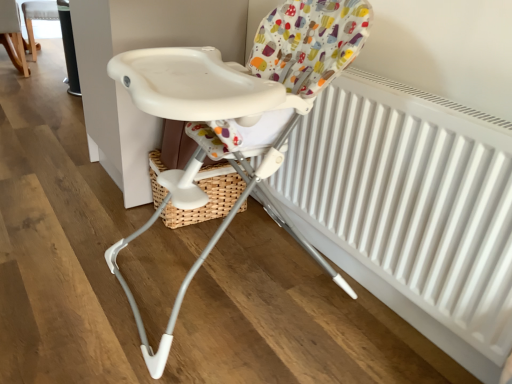
Where is `white matte radiator at center`? white matte radiator at center is located at coordinates (411, 203).

Image resolution: width=512 pixels, height=384 pixels. Find the location of `white plastic highchair at center, the first chair positioned from the right`. white plastic highchair at center, the first chair positioned from the right is located at coordinates (239, 115).

In the scene shown: From the image's perspective, is white plastic highchair at upper center, placed as the second chair when sorted from left to right, positioned above or below white plastic chair at upper left, the 2th chair ordered from the bottom?

From the image's perspective, white plastic highchair at upper center, placed as the second chair when sorted from left to right, appears above white plastic chair at upper left, the 2th chair ordered from the bottom.

Which is in front, white plastic highchair at upper center, placed as the 2th chair when sorted from right to left, or white plastic chair at upper left, the first chair viewed from the left?

white plastic chair at upper left, the first chair viewed from the left, is in front.

Which is in front, point (35, 55) or point (21, 41)?

Positioned in front is point (21, 41).

Where is `the 2nd chair located beneath the white plastic highchair at center, marked as the third chair in a top-to-bottom arrangement (from a real-world perspective)`? the 2nd chair located beneath the white plastic highchair at center, marked as the third chair in a top-to-bottom arrangement (from a real-world perspective) is located at coordinates (37, 19).

Is point (22, 3) closer or farther from the camera than point (213, 131)?

Point (22, 3).

From the picture: In the image, is white plastic highchair at upper center, which ranks as the third chair in front-to-back order, positioned in front of or behind white plastic highchair at center, the first chair positioned from the right?

white plastic highchair at upper center, which ranks as the third chair in front-to-back order, is behind white plastic highchair at center, the first chair positioned from the right.

Would you say white plastic highchair at center, acting as the first chair starting from the bottom, is to the left or to the right of white matte radiator at center in the picture?

Clearly, white plastic highchair at center, acting as the first chair starting from the bottom, is on the left of white matte radiator at center in the image.

Which of these two, white plastic highchair at center, the first chair positioned from the right, or white matte radiator at center, stands shorter?

white matte radiator at center.

Is point (282, 214) positioned after point (431, 282)?

Yes, it is behind point (431, 282).

Consider the image. Which is behind, white plastic highchair at center, acting as the first chair starting from the bottom, or white matte radiator at center?

white matte radiator at center is behind.

Considering the positions of points (22, 40) and (30, 26), is point (22, 40) farther from camera compared to point (30, 26)?

No, (22, 40) is in front of (30, 26).

Can you confirm if white plastic chair at upper left, placed as the second chair when sorted from front to back, is shorter than white plastic highchair at upper center, placed as the second chair when sorted from left to right?

Incorrect, the height of white plastic chair at upper left, placed as the second chair when sorted from front to back, does not fall short of that of white plastic highchair at upper center, placed as the second chair when sorted from left to right.

From a real-world perspective, does white plastic chair at upper left, the third chair viewed from the right, stand above white plastic highchair at upper center, which is the 1th chair in top-to-bottom order?

Yes, from a real-world perspective, white plastic chair at upper left, the third chair viewed from the right, is above white plastic highchair at upper center, which is the 1th chair in top-to-bottom order.

Which is more to the right, white plastic chair at upper left, placed as the second chair when sorted from front to back, or white plastic highchair at upper center, placed as the 2th chair when sorted from right to left?

From the viewer's perspective, white plastic highchair at upper center, placed as the 2th chair when sorted from right to left, appears more on the right side.

Considering the sizes of objects white plastic highchair at center, which ranks as the 1th chair in front-to-back order, and white plastic chair at upper left, the 2th chair ordered from the bottom, in the image provided, who is thinner, white plastic highchair at center, which ranks as the 1th chair in front-to-back order, or white plastic chair at upper left, the 2th chair ordered from the bottom,?

white plastic chair at upper left, the 2th chair ordered from the bottom.

How distant is white plastic highchair at center, the first chair positioned from the right, from white plastic chair at upper left, the 2th chair ordered from the bottom?

white plastic highchair at center, the first chair positioned from the right, is 2.80 meters away from white plastic chair at upper left, the 2th chair ordered from the bottom.

Locate an element on the screen. chair above the white plastic chair at upper left, the first chair viewed from the left (from a real-world perspective) is located at coordinates (239, 115).

Could you tell me if white plastic highchair at center, marked as the third chair in a top-to-bottom arrangement, is turned towards white plastic chair at upper left, positioned as the 2th chair in back-to-front order?

No.

From a real-world perspective, is white plastic highchair at center, marked as the third chair in a top-to-bottom arrangement, above or below white plastic highchair at upper center, which is the 1th chair in top-to-bottom order?

white plastic highchair at center, marked as the third chair in a top-to-bottom arrangement, is above white plastic highchair at upper center, which is the 1th chair in top-to-bottom order.

Considering the relative sizes of white plastic highchair at center, acting as the first chair starting from the bottom, and white plastic highchair at upper center, placed as the second chair when sorted from left to right, in the image provided, is white plastic highchair at center, acting as the first chair starting from the bottom, taller than white plastic highchair at upper center, placed as the second chair when sorted from left to right,?

Yes, white plastic highchair at center, acting as the first chair starting from the bottom, is taller than white plastic highchair at upper center, placed as the second chair when sorted from left to right.

Could you tell me if white plastic highchair at center, marked as the third chair in a top-to-bottom arrangement, is facing white plastic highchair at upper center, placed as the 2th chair when sorted from right to left?

No, white plastic highchair at center, marked as the third chair in a top-to-bottom arrangement, is not turned towards white plastic highchair at upper center, placed as the 2th chair when sorted from right to left.

Is point (224, 95) closer or farther from the camera than point (42, 18)?

Point (224, 95) appears to be closer to the viewer than point (42, 18).

From a real-world perspective, is white plastic chair at upper left, placed as the second chair when sorted from front to back, above or below white matte radiator at center?

Clearly, from a real-world perspective, white plastic chair at upper left, placed as the second chair when sorted from front to back, is below white matte radiator at center.

Which object is positioned more to the left, white plastic chair at upper left, the first chair viewed from the left, or white matte radiator at center?

Positioned to the left is white plastic chair at upper left, the first chair viewed from the left.

Considering the positions of objects white plastic chair at upper left, placed as the second chair when sorted from front to back, and white matte radiator at center in the image provided, who is in front, white plastic chair at upper left, placed as the second chair when sorted from front to back, or white matte radiator at center?

white matte radiator at center is closer to the camera.

Which point is more distant from viewer, (10, 22) or (455, 235)?

The point (10, 22) is behind.

This screenshot has width=512, height=384. In order to click on the 1st chair above the white plastic highchair at upper center, which is the third chair from bottom to top (from a real-world perspective) in this screenshot , I will do `click(12, 35)`.

From the white plastic highchair at center, which ranks as the 1th chair in front-to-back order, count the 1st chair to the left and point to it. Please provide its 2D coordinates.

[(37, 19)]

Considering their positions, is white plastic chair at upper left, the third chair viewed from the right, positioned closer to white plastic highchair at upper center, the first chair from the back, than white matte radiator at center?

white plastic chair at upper left, the third chair viewed from the right, lies closer to white plastic highchair at upper center, the first chair from the back, than the other object.

Looking at the image, which one is located further to white plastic chair at upper left, placed as the second chair when sorted from front to back, white plastic highchair at center, the first chair positioned from the right, or white matte radiator at center?

white matte radiator at center is positioned further to the anchor white plastic chair at upper left, placed as the second chair when sorted from front to back.

Consider the image. Estimate the real-world distances between objects in this image. Which object is closer to white plastic highchair at center, marked as the third chair in a top-to-bottom arrangement, white matte radiator at center or white plastic chair at upper left, positioned as the 2th chair in back-to-front order?

Among the two, white matte radiator at center is located nearer to white plastic highchair at center, marked as the third chair in a top-to-bottom arrangement.

When comparing their distances from white plastic chair at upper left, positioned as the 2th chair in back-to-front order, does white plastic highchair at center, arranged as the third chair when viewed from the back, or white plastic highchair at upper center, the first chair from the back, seem further?

white plastic highchair at center, arranged as the third chair when viewed from the back, is positioned further to the anchor white plastic chair at upper left, positioned as the 2th chair in back-to-front order.

Estimate the real-world distances between objects in this image. Which object is closer to white plastic highchair at upper center, placed as the second chair when sorted from left to right, white matte radiator at center or white plastic highchair at center, marked as the 3th chair in a left-to-right arrangement?

The object closer to white plastic highchair at upper center, placed as the second chair when sorted from left to right, is white plastic highchair at center, marked as the 3th chair in a left-to-right arrangement.

From the image, which object appears to be farther from white matte radiator at center, white plastic highchair at center, the first chair positioned from the right, or white plastic chair at upper left, the 2th chair ordered from the bottom?

white plastic chair at upper left, the 2th chair ordered from the bottom, is positioned further to the anchor white matte radiator at center.

Estimate the real-world distances between objects in this image. Which object is closer to white plastic highchair at center, marked as the 3th chair in a left-to-right arrangement, white plastic highchair at upper center, which is the 1th chair in top-to-bottom order, or white matte radiator at center?

The object closer to white plastic highchair at center, marked as the 3th chair in a left-to-right arrangement, is white matte radiator at center.

Estimate the real-world distances between objects in this image. Which object is closer to white plastic chair at upper left, the 2th chair ordered from the bottom, white plastic highchair at upper center, placed as the second chair when sorted from left to right, or white matte radiator at center?

white plastic highchair at upper center, placed as the second chair when sorted from left to right.

Where is `chair positioned between white matte radiator at center and white plastic highchair at upper center, placed as the 2th chair when sorted from right to left, from near to far`? This screenshot has height=384, width=512. chair positioned between white matte radiator at center and white plastic highchair at upper center, placed as the 2th chair when sorted from right to left, from near to far is located at coordinates (12, 35).

This screenshot has width=512, height=384. Identify the location of radiator between white plastic highchair at center, acting as the first chair starting from the bottom, and white plastic highchair at upper center, which is the third chair from bottom to top, from front to back. (411, 203).

The height and width of the screenshot is (384, 512). Identify the location of radiator located between white plastic highchair at center, marked as the third chair in a top-to-bottom arrangement, and white plastic chair at upper left, placed as the second chair when sorted from front to back, in the depth direction. (411, 203).

I want to click on chair between white plastic highchair at center, which ranks as the 1th chair in front-to-back order, and white plastic highchair at upper center, placed as the 2th chair when sorted from right to left, in the front-back direction, so click(x=12, y=35).